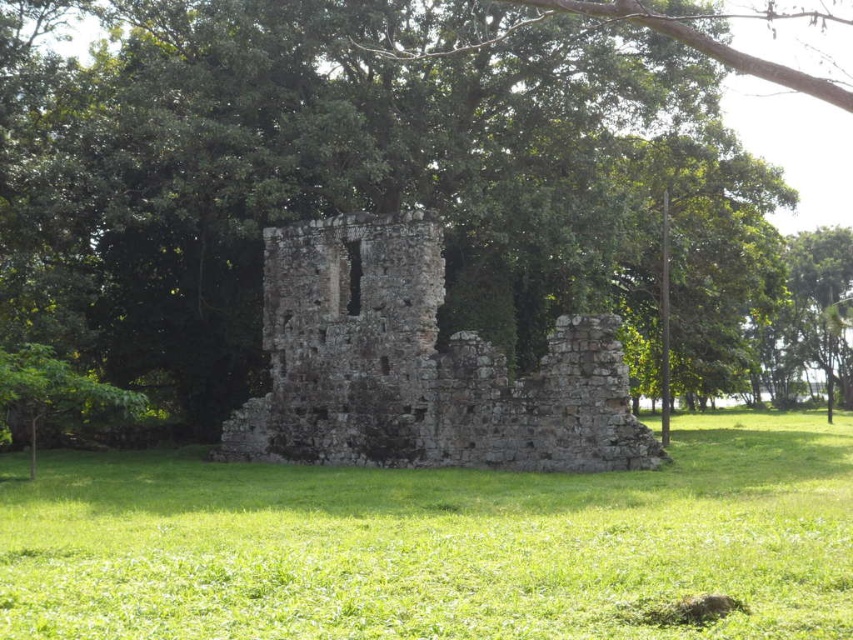
Which is behind, point (274, 593) or point (537, 467)?

The point (537, 467) is more distant.

Does green grass at center appear on the right side of rustic stone castle at center?

No, green grass at center is not to the right of rustic stone castle at center.

Who is more forward, (633, 500) or (433, 458)?

Positioned in front is point (633, 500).

The image size is (853, 640). Identify the location of green grass at center. (436, 545).

Looking at this image, who is shorter, green leafy tree at center or rustic stone castle at center?

With less height is rustic stone castle at center.

Can you confirm if green leafy tree at center is wider than rustic stone castle at center?

Indeed, green leafy tree at center has a greater width compared to rustic stone castle at center.

Which is in front, point (569, 120) or point (397, 456)?

Point (397, 456) is more forward.

What are the coordinates of `green leafy tree at center` in the screenshot? It's located at (393, 216).

Does green leafy tree at center appear on the right side of green grass at center?

Correct, you'll find green leafy tree at center to the right of green grass at center.

The height and width of the screenshot is (640, 853). Describe the element at coordinates (393, 216) in the screenshot. I see `green leafy tree at center` at that location.

Who is more forward, [440,452] or [395,620]?

Point [395,620]

Where is `green leafy tree at center`? This screenshot has height=640, width=853. green leafy tree at center is located at coordinates (393, 216).